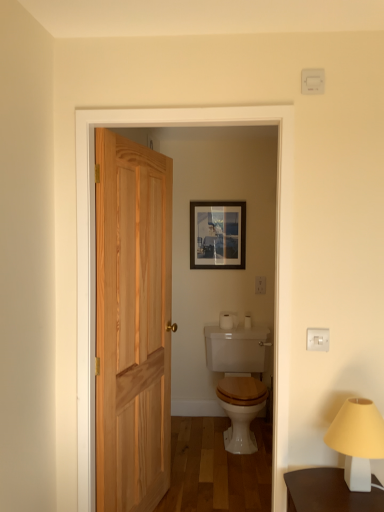
Question: Is white glossy toilet at center bigger or smaller than natural wood screen door at center?

Choices:
 (A) small
 (B) big

Answer: (B)

Question: Considering the positions of white glossy toilet at center and natural wood screen door at center in the image, is white glossy toilet at center taller or shorter than natural wood screen door at center?

Choices:
 (A) tall
 (B) short

Answer: (B)

Question: Which object is the closest to the matte glass picture frame at center?

Choices:
 (A) natural wood screen door at center
 (B) white matte table lamp at lower right
 (C) white matte toilet paper at center
 (D) natural wood door at left
 (E) white glossy toilet at center

Answer: (C)

Question: Which object is the farthest from the white glossy toilet at center?

Choices:
 (A) white matte table lamp at lower right
 (B) natural wood door at left
 (C) natural wood screen door at center
 (D) white matte toilet paper at center
 (E) matte glass picture frame at center

Answer: (C)